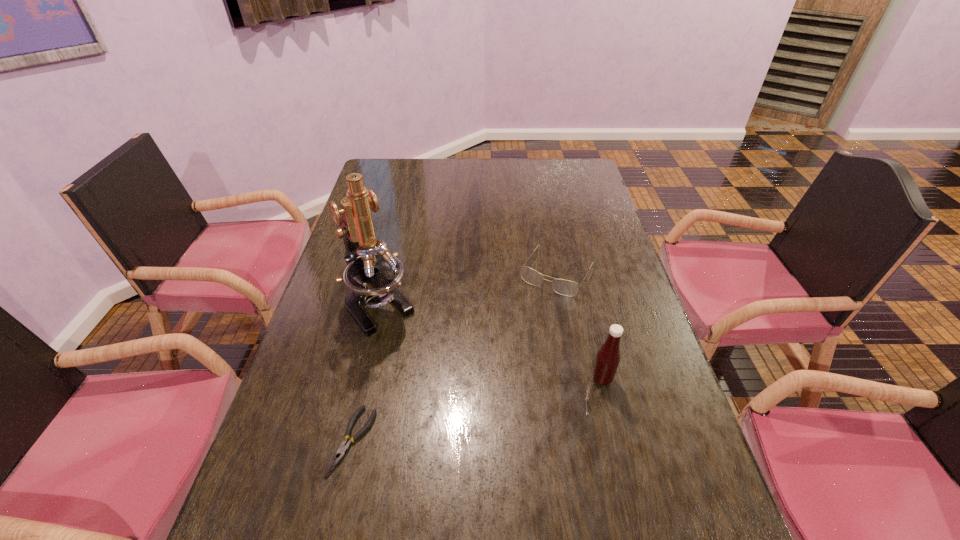
This screenshot has width=960, height=540. In the image, there is a desktop. Identify the location of free space at the far edge. (420, 179).

The height and width of the screenshot is (540, 960). In order to click on vacant area at the near edge in this screenshot , I will do `click(372, 492)`.

In the image, there is a desktop. Where is `free space at the left edge`? This screenshot has width=960, height=540. free space at the left edge is located at coordinates click(292, 392).

Locate an element on the screen. This screenshot has width=960, height=540. vacant region at the right edge is located at coordinates (620, 281).

You are a GUI agent. You are given a task and a screenshot of the screen. Output one action in this format:
    pyautogui.click(x=<x>, y=<y>)
    Task: Click on the free region at the far right corner of the desktop
    
    Given the screenshot: What is the action you would take?
    pyautogui.click(x=593, y=177)

The image size is (960, 540). Identify the location of free point between the third farthest object and the spectacles. point(580,326).

The image size is (960, 540). In order to click on free space between the second shortest object and the shortest object in this screenshot , I will do `click(455, 356)`.

The height and width of the screenshot is (540, 960). Find the location of `vacant space that's between the second shortest object and the second tallest object`. vacant space that's between the second shortest object and the second tallest object is located at coordinates (580, 326).

Find the location of a particular element. This screenshot has width=960, height=540. free space between the microscope and the nearest object is located at coordinates (366, 373).

Find the location of a particular element. The height and width of the screenshot is (540, 960). vacant area between the microscope and the second tallest object is located at coordinates (490, 342).